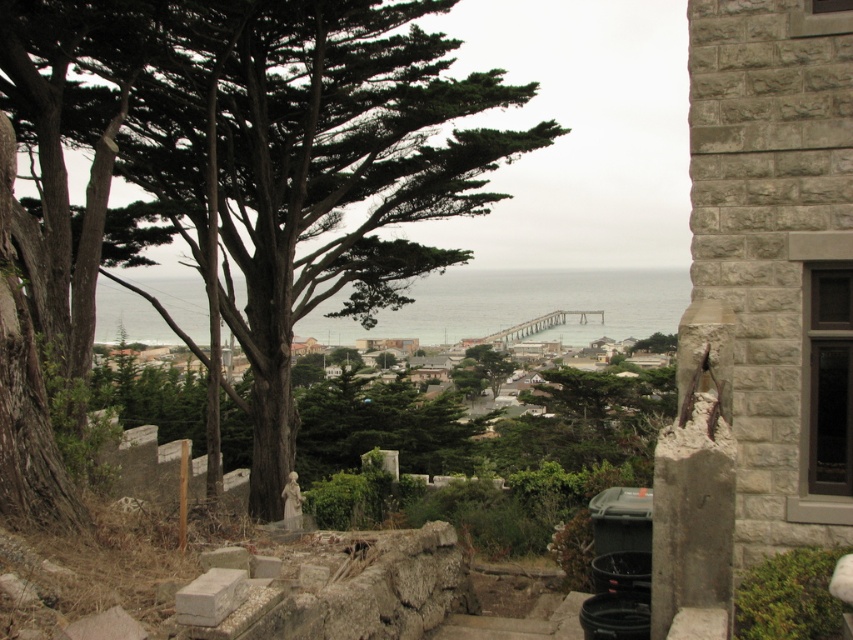
Based on the photo, is green rough bark tree at center bigger than clear water at center?

Actually, green rough bark tree at center might be smaller than clear water at center.

Is green rough bark tree at center positioned before clear water at center?

Yes, it is in front of clear water at center.

What do you see at coordinates (254, 156) in the screenshot?
I see `green rough bark tree at center` at bounding box center [254, 156].

You are a GUI agent. You are given a task and a screenshot of the screen. Output one action in this format:
    pyautogui.click(x=<x>, y=<y>)
    Task: Click on the green rough bark tree at center
    The image size is (853, 640).
    Given the screenshot: What is the action you would take?
    pyautogui.click(x=254, y=156)